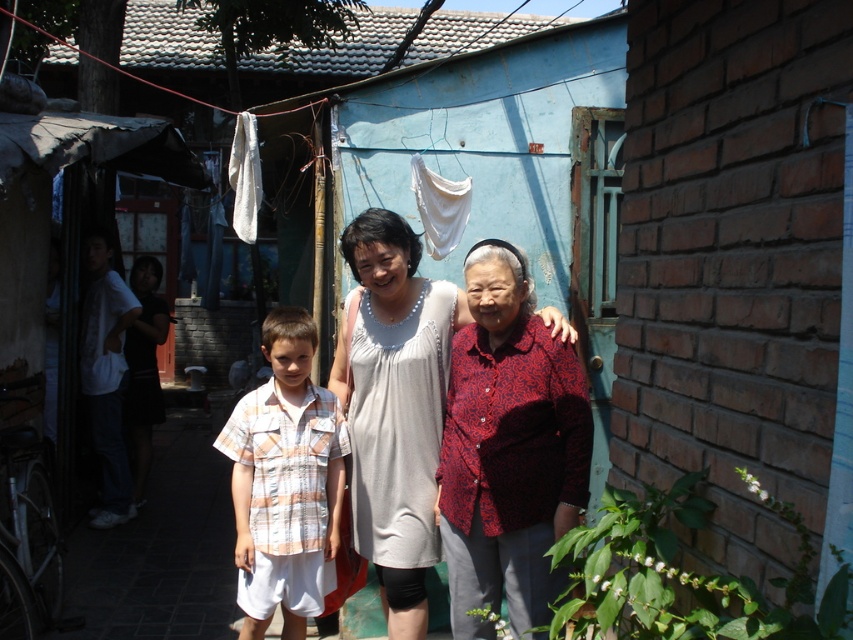
Can you confirm if red patterned blouse at center is positioned below striped cotton shirt at center?

Incorrect, red patterned blouse at center is not positioned below striped cotton shirt at center.

The width and height of the screenshot is (853, 640). What do you see at coordinates (508, 449) in the screenshot?
I see `red patterned blouse at center` at bounding box center [508, 449].

Which is behind, point (509, 611) or point (306, 520)?

Positioned behind is point (306, 520).

Locate an element on the screen. red patterned blouse at center is located at coordinates (508, 449).